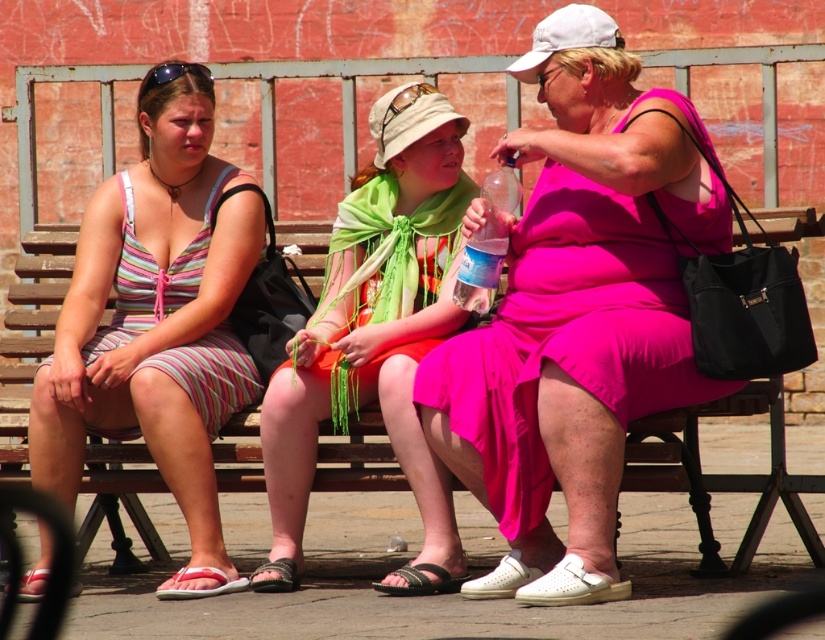
You are standing in front of the wooden bench at center and the matte brown goggles at center. Which object is closer to you?

The wooden bench at center is closer to you because it is in front of the matte brown goggles at center.